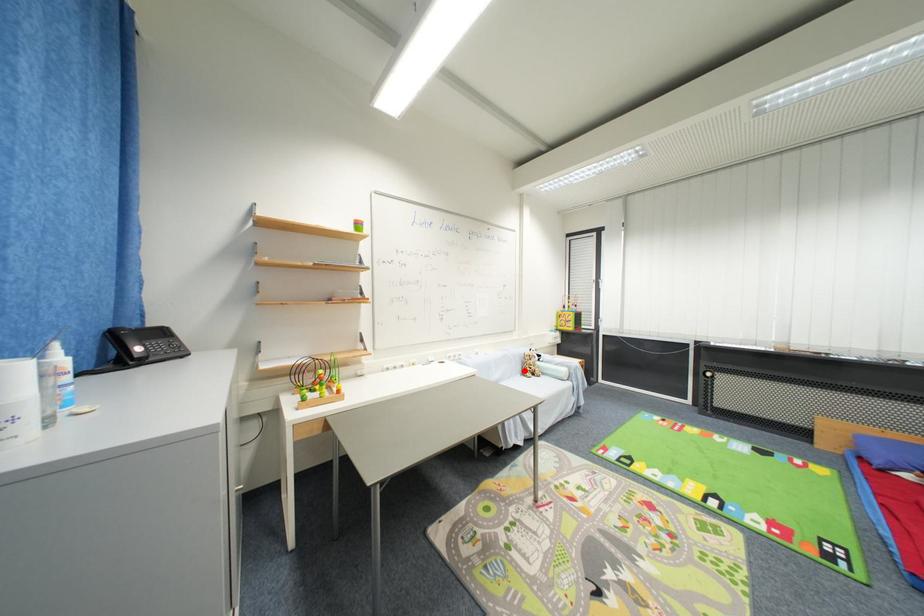
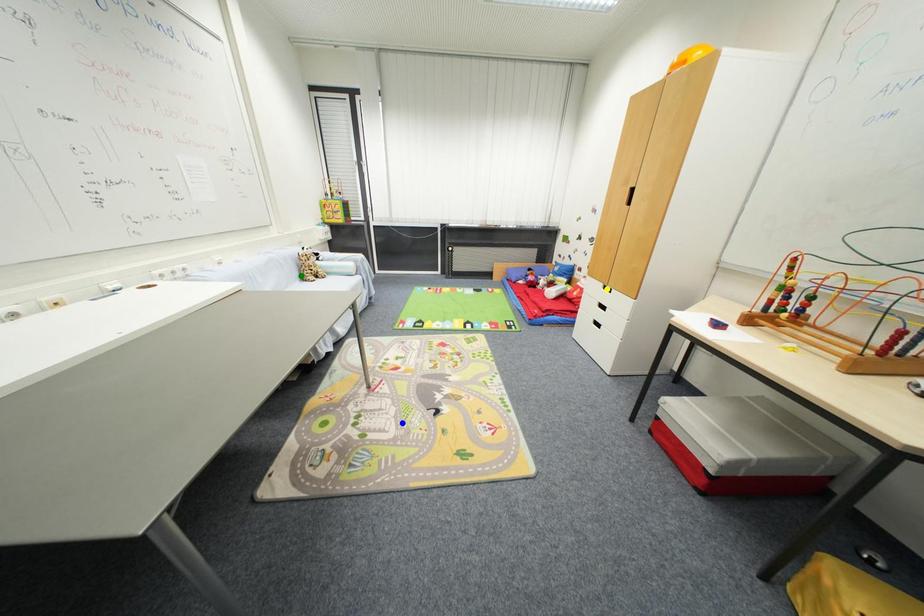
Question: I am providing you with two images of the same scene from different viewpoints. A red point is marked on the first image. You are given multiple points on the second image. Which point in image 2 represents the same 3d spot as the red point in image 1?

Choices:
 (A) yellow point
 (B) green point
 (C) blue point

Answer: (B)